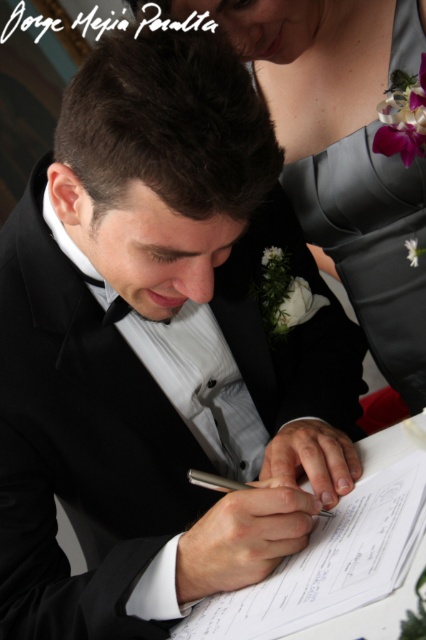
Question: Can you confirm if satin gray dress at upper right is wider than metallic silver pen at center?

Choices:
 (A) no
 (B) yes

Answer: (B)

Question: Which object appears closest to the camera in this image?

Choices:
 (A) satin gray dress at upper right
 (B) metallic silver pen at center

Answer: (B)

Question: Which of the following is the farthest from the observer?

Choices:
 (A) metallic silver pen at center
 (B) satin gray dress at upper right

Answer: (B)

Question: Is satin gray dress at upper right thinner than metallic silver pen at center?

Choices:
 (A) yes
 (B) no

Answer: (B)

Question: Where is satin gray dress at upper right located in relation to metallic silver pen at center in the image?

Choices:
 (A) below
 (B) above

Answer: (B)